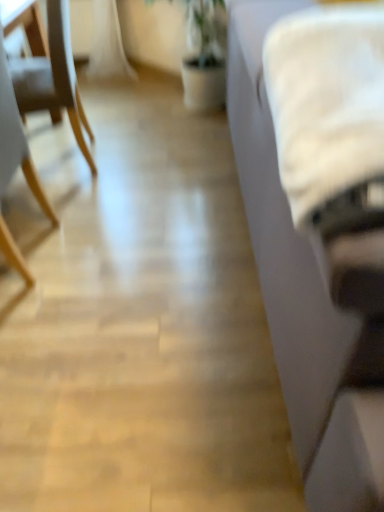
You are a GUI agent. You are given a task and a screenshot of the screen. Output one action in this format:
    pyautogui.click(x=<x>, y=<y>)
    Task: Click on the vacant area that is situated to the right of light wood chair at left, which appears as the 1th chair when viewed from the back
    This screenshot has width=384, height=512.
    Given the screenshot: What is the action you would take?
    pyautogui.click(x=137, y=158)